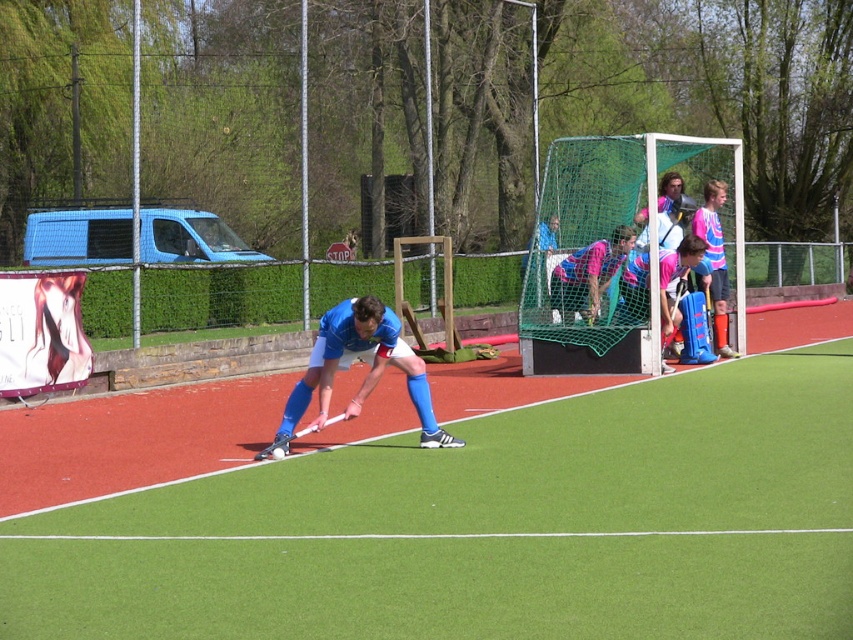
You are a coach observing the field hockey practice. You notice two groups of players wearing pink jerseys. One group is near the goal wearing pink jersey at goal, and another group has matte pink jersey at center. Which group has the larger jerseys?

The matte pink jersey at center is larger than the pink jersey at goal.

You are a photographer trying to capture the best angle of the field hockey scene. You notice two points marked in the image at coordinates point (848, 620) and point (590, 253). Which point would be better to focus on if you want to ensure the foreground player is in sharp focus?

Point (848, 620) is closer to the camera than point (590, 253), so focusing on point (848, 620) would better ensure the foreground player is in sharp focus since it is nearer to the camera.